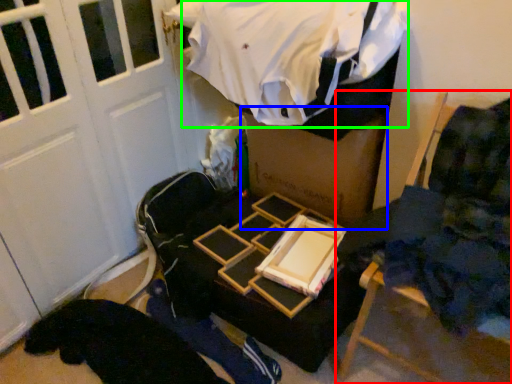
Question: Considering the real-world distances, which object is farthest from furniture (highlighted by a red box)? box (highlighted by a blue box) or clothing (highlighted by a green box)?

Choices:
 (A) box
 (B) clothing

Answer: (B)